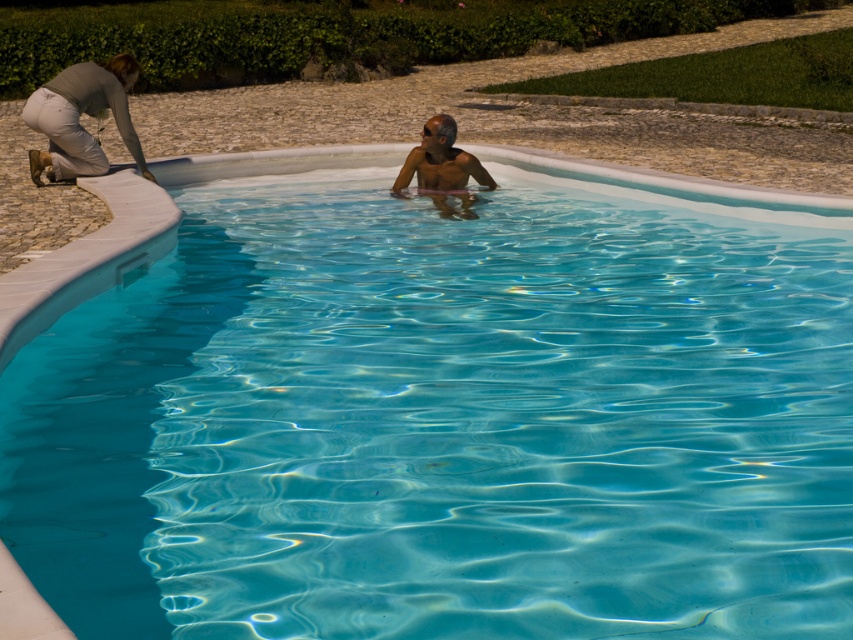
You are standing at the edge of the swimming pool and see the green leafy hedge at upper center and the smooth skin man at center. Which object is wider?

The green leafy hedge at upper center is wider than the smooth skin man at center.

You are standing at the center of the paved pathway leading to the swimming pool. Looking towards the pool, where is the green leafy hedge at upper center located in relation to your position?

The green leafy hedge at upper center is located at the upper center position, which is above and slightly to the left of the center point of the image.